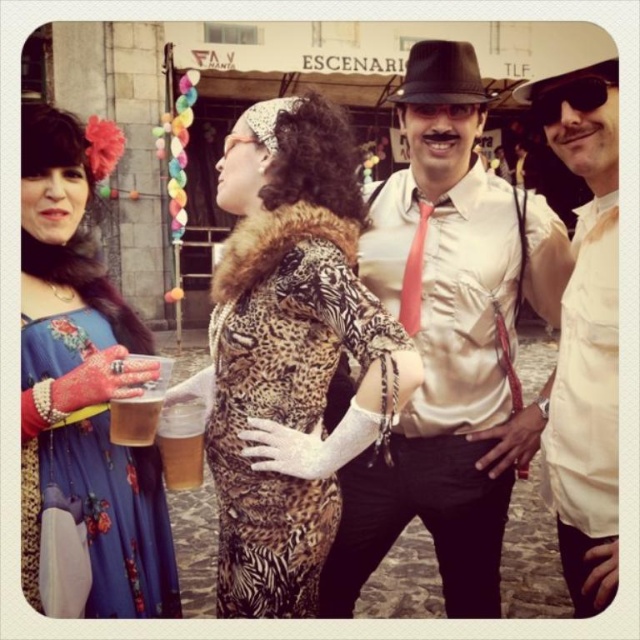
Who is more forward, (49,115) or (570,531)?

Positioned in front is point (49,115).

What do you see at coordinates (81, 396) in the screenshot? This screenshot has width=640, height=640. I see `blue floral dress at left` at bounding box center [81, 396].

Locate an element on the screen. The height and width of the screenshot is (640, 640). blue floral dress at left is located at coordinates [x=81, y=396].

Measure the distance between point (188, 448) and camera.

A distance of 21.22 meters exists between point (188, 448) and camera.

This screenshot has width=640, height=640. Find the location of `translucent plastic cup at center`. translucent plastic cup at center is located at coordinates (180, 444).

Describe the element at coordinates (180, 444) in the screenshot. The width and height of the screenshot is (640, 640). I see `translucent plastic cup at center` at that location.

Where is `translucent plastic cup at center`? This screenshot has height=640, width=640. translucent plastic cup at center is located at coordinates (180, 444).

Is leopard print dress at center further to the viewer compared to white cotton shirt at center?

No, it is in front of white cotton shirt at center.

Looking at this image, between leopard print dress at center and white cotton shirt at center, which one appears on the right side from the viewer's perspective?

white cotton shirt at center

Consider the image. Measure the distance between leopard print dress at center and camera.

They are 19.15 meters apart.

What are the coordinates of `leopard print dress at center` in the screenshot? It's located at (289, 353).